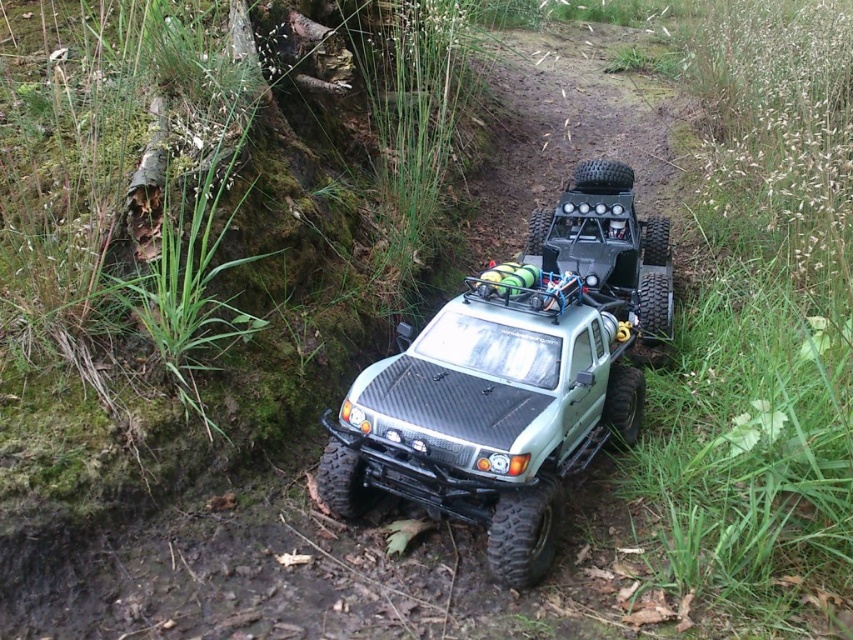
Is point (514, 310) positioned after point (601, 193)?

No.

Locate an element on the screen. This screenshot has height=640, width=853. green matte truck at center is located at coordinates (514, 378).

You are a GUI agent. You are given a task and a screenshot of the screen. Output one action in this format:
    pyautogui.click(x=<x>, y=<y>)
    Task: Click on the green matte truck at center
    
    Given the screenshot: What is the action you would take?
    pyautogui.click(x=514, y=378)

The height and width of the screenshot is (640, 853). Find the location of `green matte truck at center`. green matte truck at center is located at coordinates (514, 378).